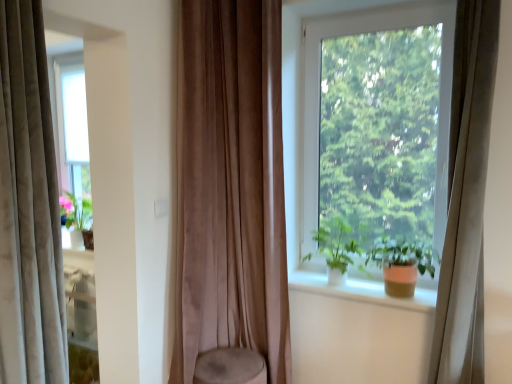
Image resolution: width=512 pixels, height=384 pixels. What are the coordinates of `free spot above transparent glass window at center (from a real-world perspective)` in the screenshot? It's located at (378, 11).